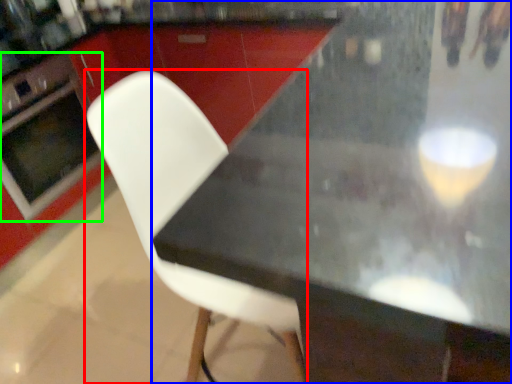
Question: Considering the real-world distances, which object is farthest from chair (highlighted by a red box)? table (highlighted by a blue box) or oven (highlighted by a green box)?

Choices:
 (A) table
 (B) oven

Answer: (B)